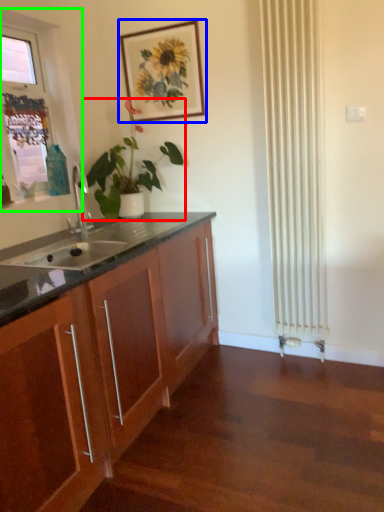
Question: Which is nearer to the houseplant (highlighted by a red box)? picture frame (highlighted by a blue box) or window frame (highlighted by a green box).

Choices:
 (A) picture frame
 (B) window frame

Answer: (A)